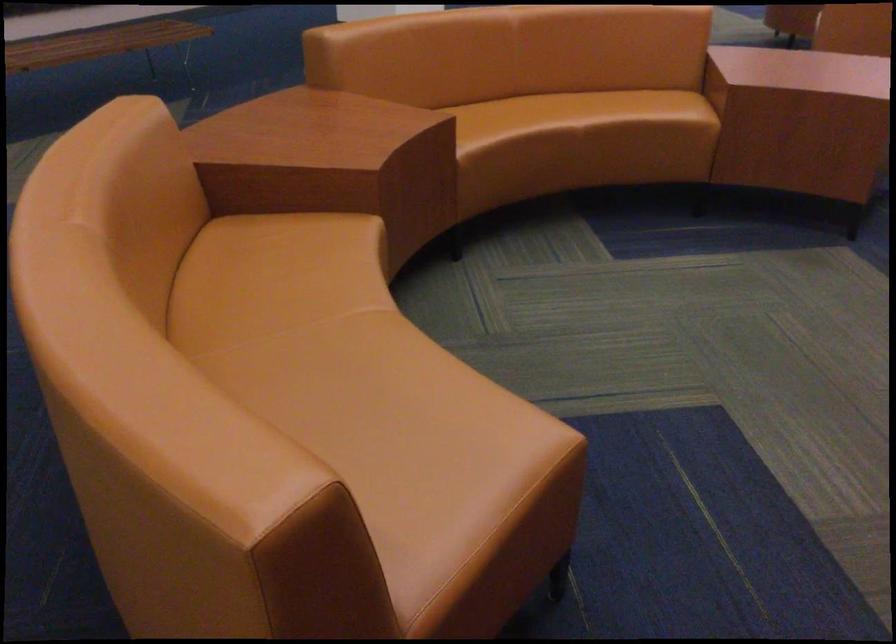
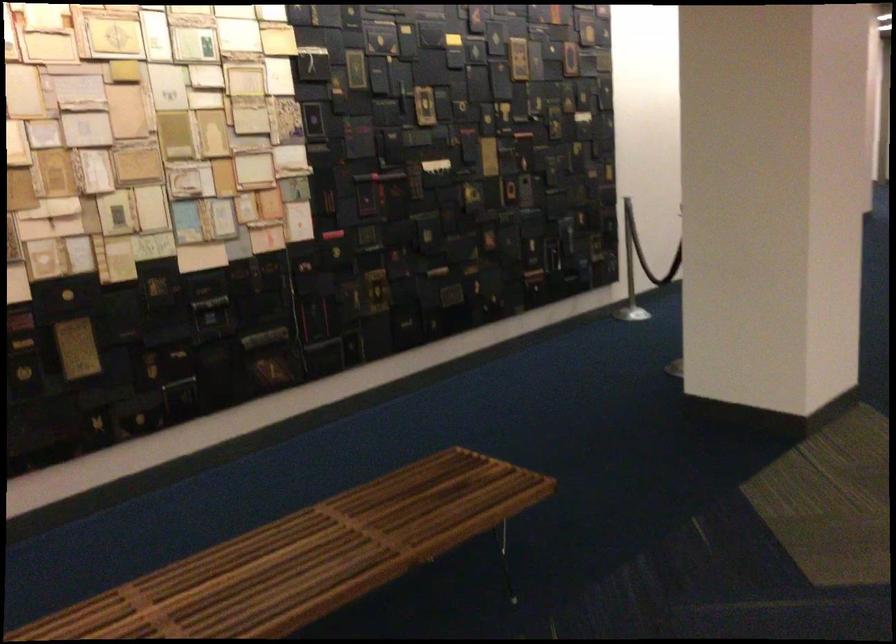
The images are taken continuously from a first-person perspective. In which direction are you moving?

The cameraman moved toward left, forward.